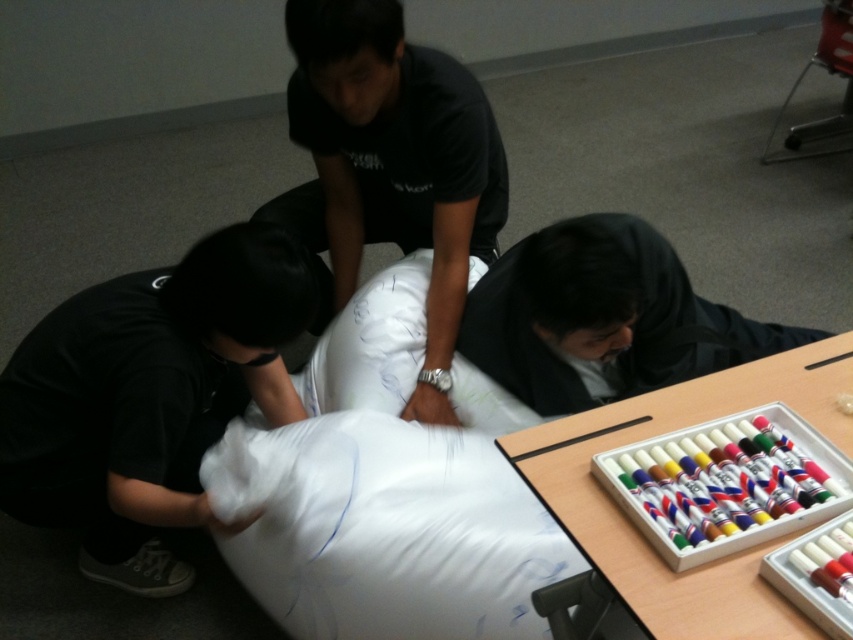
Is black matte pillow at lower left to the left of black matte shirt at center from the viewer's perspective?

Yes, black matte pillow at lower left is to the left of black matte shirt at center.

Consider the image. Is black matte pillow at lower left wider than black matte shirt at center?

Indeed, black matte pillow at lower left has a greater width compared to black matte shirt at center.

At what (x,y) coordinates should I click in order to perform the action: click on black matte pillow at lower left. Please return your answer as a coordinate pair (x, y). Looking at the image, I should click on (146, 396).

Which is more to the right, black matte pillow at lower left or wooden table at lower right?

From the viewer's perspective, wooden table at lower right appears more on the right side.

Can you confirm if black matte pillow at lower left is shorter than wooden table at lower right?

No, black matte pillow at lower left is not shorter than wooden table at lower right.

Who is more distant from viewer, (115, 468) or (825, 340)?

The point (825, 340) is behind.

At what (x,y) coordinates should I click in order to perform the action: click on black matte pillow at lower left. Please return your answer as a coordinate pair (x, y). Looking at the image, I should click on tap(146, 396).

How much distance is there between black matte shirt at center and wooden table at lower right?

The distance of black matte shirt at center from wooden table at lower right is 29.77 inches.

Which is below, black matte shirt at center or wooden table at lower right?

wooden table at lower right is below.

At what (x,y) coordinates should I click in order to perform the action: click on black matte shirt at center. Please return your answer as a coordinate pair (x, y). This screenshot has height=640, width=853. Looking at the image, I should click on (392, 164).